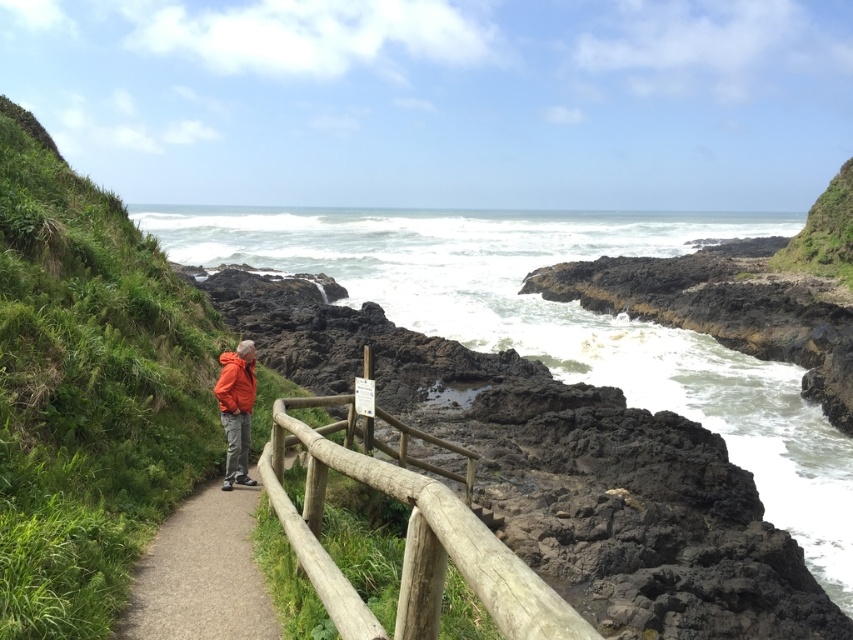
Does gravel path at center have a greater width compared to orange fleece jacket at center?

Yes.

What do you see at coordinates (201, 573) in the screenshot? I see `gravel path at center` at bounding box center [201, 573].

Is point (227, 572) more distant than point (242, 420)?

No, (227, 572) is in front of (242, 420).

Find the location of a particular element. This screenshot has height=640, width=853. gravel path at center is located at coordinates (201, 573).

Can you confirm if natural wood railing at center is shorter than orange fleece jacket at center?

Yes, natural wood railing at center is shorter than orange fleece jacket at center.

Between point (312, 429) and point (225, 387), which one is positioned behind?

The point (225, 387) is behind.

Locate an element on the screen. The image size is (853, 640). natural wood railing at center is located at coordinates (408, 545).

Which is behind, point (469, 520) or point (136, 625)?

The point (136, 625) is more distant.

Is natural wood railing at center below gravel path at center?

No, natural wood railing at center is not below gravel path at center.

Does point (322, 593) lie behind point (212, 600)?

No, (322, 593) is closer to viewer.

The height and width of the screenshot is (640, 853). I want to click on natural wood railing at center, so click(408, 545).